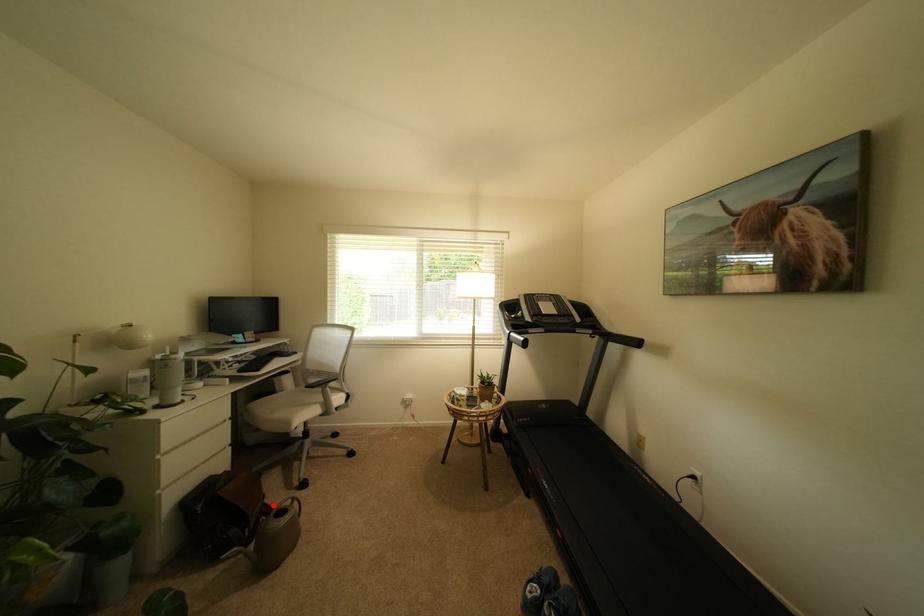
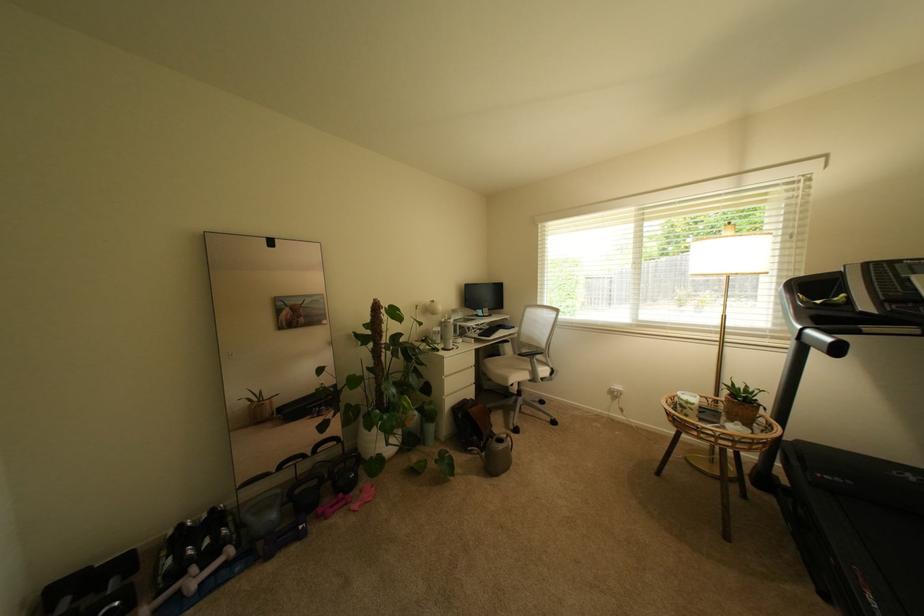
Question: I am providing you with two images of the same scene from different viewpoints. A red point is shown in image1. For the corresponding object point in image2, is it positioned nearer or farther from the camera?

Choices:
 (A) Nearer
 (B) Farther

Answer: (B)